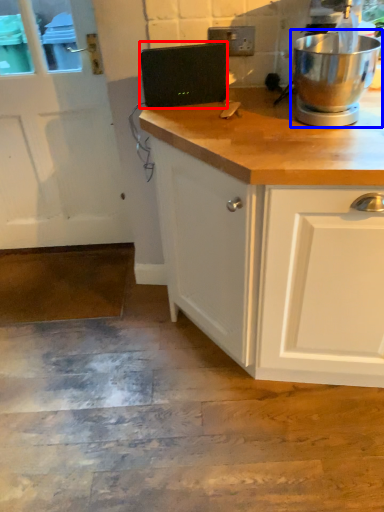
Question: Which of the following is the farthest to the observer, appliance (highlighted by a red box) or home appliance (highlighted by a blue box)?

Choices:
 (A) appliance
 (B) home appliance

Answer: (A)